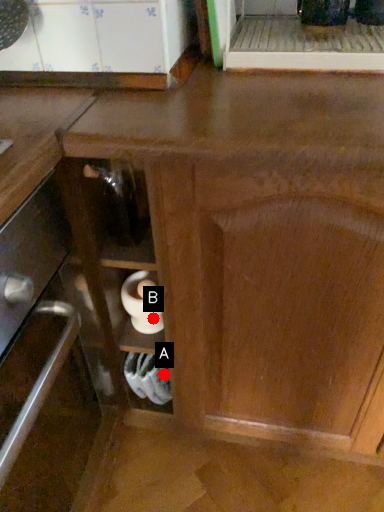
Question: Two points are circled on the image, labeled by A and B beside each circle. Which of the following is the closest to the observer?

Choices:
 (A) A is closer
 (B) B is closer

Answer: (B)